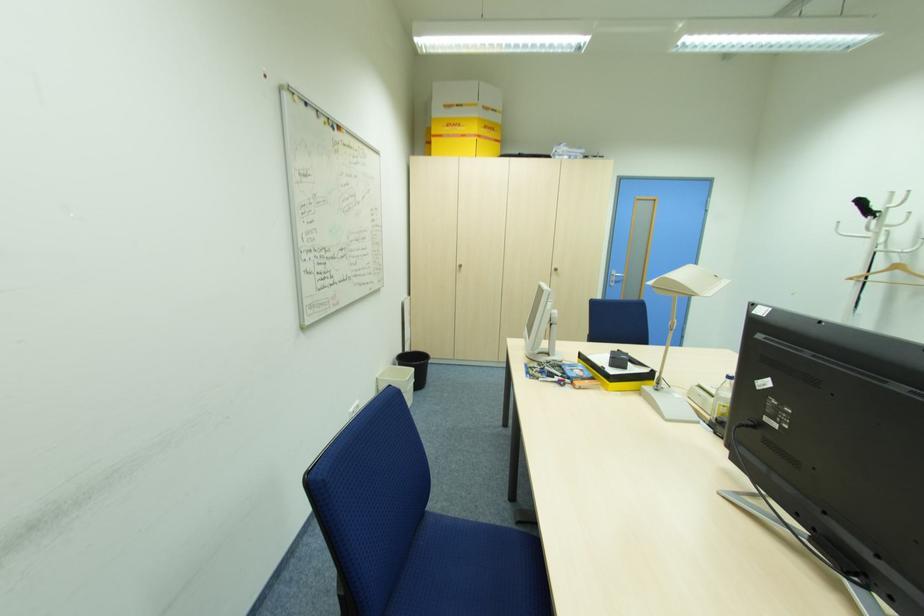
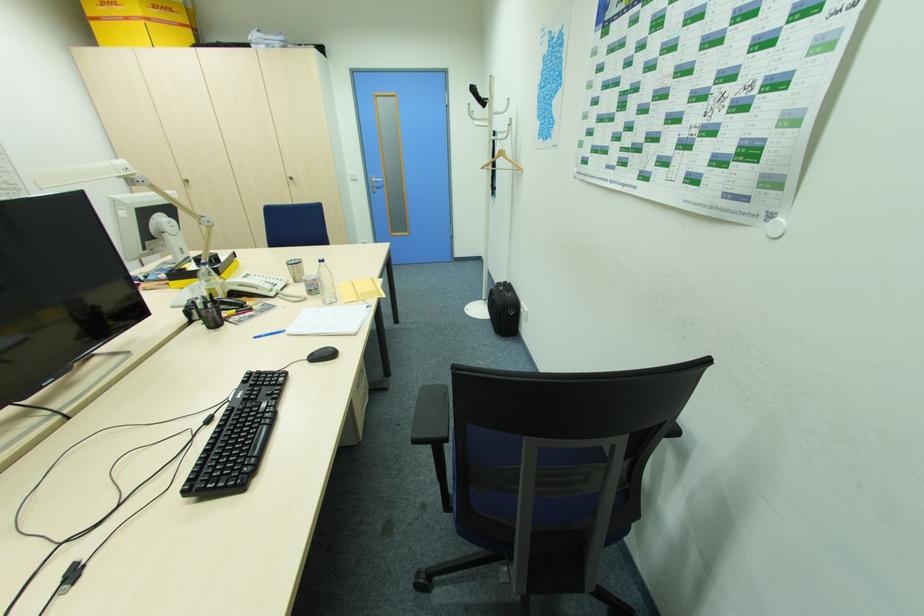
In the second image, find the point that corresponds to (614,382) in the first image.

(173, 281)